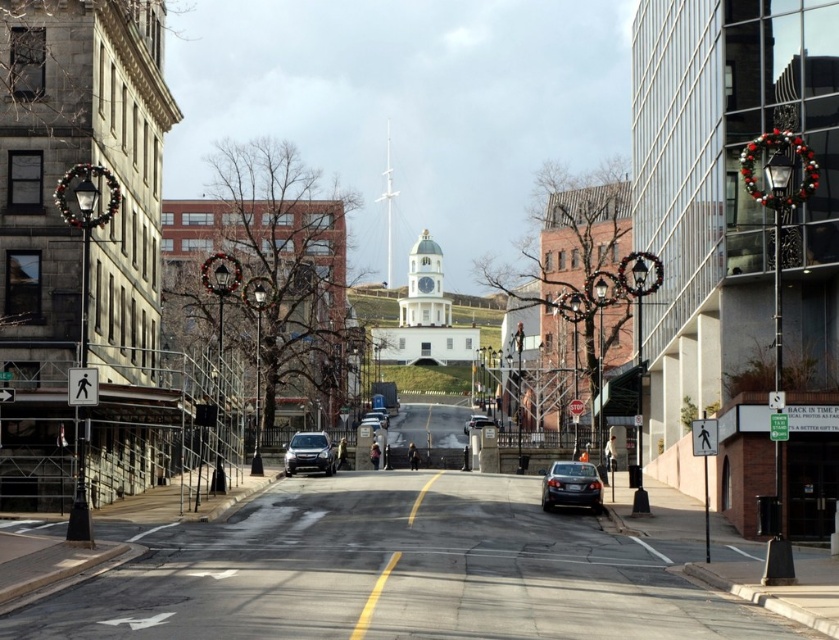
Can you confirm if matte black suv at center is positioned below matte black sedan at center?

No.

Between matte black suv at center and matte black sedan at center, which one appears on the left side from the viewer's perspective?

matte black suv at center

Does point (318, 468) come in front of point (362, 419)?

Yes.

The height and width of the screenshot is (640, 839). What are the coordinates of `matte black suv at center` in the screenshot? It's located at (309, 452).

Does white glossy spire at center appear on the right side of shiny silver sedan at center?

Incorrect, white glossy spire at center is not on the right side of shiny silver sedan at center.

Who is taller, white glossy spire at center or shiny silver sedan at center?

Standing taller between the two is white glossy spire at center.

Is point (392, 193) less distant than point (487, 419)?

No.

The height and width of the screenshot is (640, 839). What are the coordinates of `white glossy spire at center` in the screenshot? It's located at (388, 205).

Does point (577, 467) come closer to viewer compared to point (462, 428)?

Yes, it is in front of point (462, 428).

Between point (561, 472) and point (488, 419), which one is positioned in front?

Positioned in front is point (561, 472).

The height and width of the screenshot is (640, 839). In order to click on shiny black sedan at center in this screenshot , I will do `click(571, 484)`.